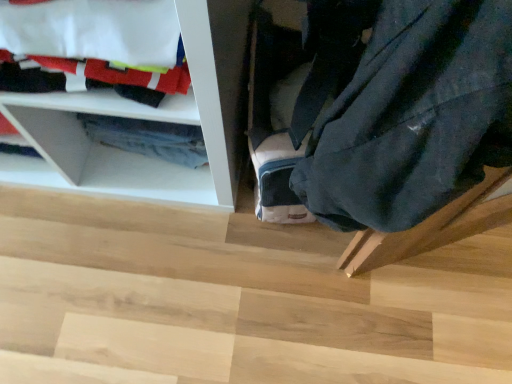
The height and width of the screenshot is (384, 512). I want to click on wooden step at lower right, so click(236, 300).

Measure the distance between point (x=347, y=91) and camera.

The depth of point (x=347, y=91) is 16.02 inches.

Where is `wooden step at lower right`? The image size is (512, 384). wooden step at lower right is located at coordinates (236, 300).

Considering the sizes of dark blue fabric at lower right and wooden step at lower right in the image, is dark blue fabric at lower right bigger or smaller than wooden step at lower right?

Clearly, dark blue fabric at lower right is smaller in size than wooden step at lower right.

Is dark blue fabric at lower right facing towards wooden step at lower right?

No, dark blue fabric at lower right does not turn towards wooden step at lower right.

Is dark blue fabric at lower right shorter than wooden step at lower right?

No.

Is dark blue fabric at lower right wider than wooden step at lower right?

Incorrect, the width of dark blue fabric at lower right does not surpass that of wooden step at lower right.

You are a GUI agent. You are given a task and a screenshot of the screen. Output one action in this format:
    pyautogui.click(x=<x>, y=<y>)
    Task: Click on the stair below the dark blue fabric at lower right (from the image's perspective)
    The image size is (512, 384).
    Given the screenshot: What is the action you would take?
    pyautogui.click(x=236, y=300)

Is dark blue fabric at lower right located within wooden step at lower right?

Definitely not — dark blue fabric at lower right is not inside wooden step at lower right.

In the scene shown: Can you confirm if wooden step at lower right is bigger than dark blue fabric at lower right?

Yes, wooden step at lower right is bigger than dark blue fabric at lower right.

Considering the relative positions of wooden step at lower right and dark blue fabric at lower right in the image provided, is wooden step at lower right to the left or to the right of dark blue fabric at lower right?

wooden step at lower right is to the left of dark blue fabric at lower right.

From the image's perspective, relative to white fabric at upper left, is wooden step at lower right above or below?

wooden step at lower right is below white fabric at upper left.

You are a GUI agent. You are given a task and a screenshot of the screen. Output one action in this format:
    pyautogui.click(x=<x>, y=<y>)
    Task: Click on the stair directly beneath the white fabric at upper left (from a real-world perspective)
    This screenshot has width=512, height=384.
    Given the screenshot: What is the action you would take?
    pyautogui.click(x=236, y=300)

Is wooden step at lower right further to the viewer compared to white fabric at upper left?

Yes, wooden step at lower right is further from the camera.

In order to click on clothing located on the right of white fabric at upper left in this screenshot , I will do `click(414, 117)`.

From the image's perspective, is white fabric at upper left located above or below dark blue fabric at lower right?

Based on their image positions, white fabric at upper left is located above dark blue fabric at lower right.

Is white fabric at upper left far away from dark blue fabric at lower right?

No, white fabric at upper left is in close proximity to dark blue fabric at lower right.

Is dark blue fabric at lower right not near white fabric at upper left?

dark blue fabric at lower right is actually quite close to white fabric at upper left.

Between dark blue fabric at lower right and white fabric at upper left, which one has less height?

white fabric at upper left.

From a real-world perspective, relative to white fabric at upper left, is dark blue fabric at lower right vertically above or below?

dark blue fabric at lower right is situated higher than white fabric at upper left in the real world.

Between dark blue fabric at lower right and white fabric at upper left, which one has smaller width?

white fabric at upper left is thinner.

Choose the correct answer: Is white fabric at upper left inside wooden step at lower right or outside it?

white fabric at upper left is not inside wooden step at lower right, it's outside.

The height and width of the screenshot is (384, 512). Find the location of `laundry lying in front of the wooden step at lower right`. laundry lying in front of the wooden step at lower right is located at coordinates (95, 45).

Between point (96, 29) and point (198, 213), which one is positioned behind?

The point (198, 213) is more distant.

Consider the image. Does white fabric at upper left touch wooden step at lower right?

No, white fabric at upper left is not making contact with wooden step at lower right.

Find the location of a particular element. stair lying behind the dark blue fabric at lower right is located at coordinates pyautogui.click(x=236, y=300).

Locate an element on the screen. This screenshot has height=384, width=512. stair on the left of dark blue fabric at lower right is located at coordinates (236, 300).

When comparing their distances from dark blue fabric at lower right, does wooden step at lower right or white fabric at upper left seem further?

wooden step at lower right.

In the scene shown: Which object lies nearer to the anchor point dark blue fabric at lower right, white fabric at upper left or wooden step at lower right?

white fabric at upper left is closer to dark blue fabric at lower right.

Looking at this image, which object lies further to the anchor point white fabric at upper left, dark blue fabric at lower right or wooden step at lower right?

The object further to white fabric at upper left is wooden step at lower right.

When comparing their distances from wooden step at lower right, does white fabric at upper left or dark blue fabric at lower right seem closer?

white fabric at upper left.

Looking at the image, which one is located further to white fabric at upper left, wooden step at lower right or dark blue fabric at lower right?

wooden step at lower right lies further to white fabric at upper left than the other object.

From the image, which object appears to be farther from wooden step at lower right, dark blue fabric at lower right or white fabric at upper left?

The object further to wooden step at lower right is dark blue fabric at lower right.

I want to click on laundry between dark blue fabric at lower right and wooden step at lower right along the z-axis, so click(x=95, y=45).